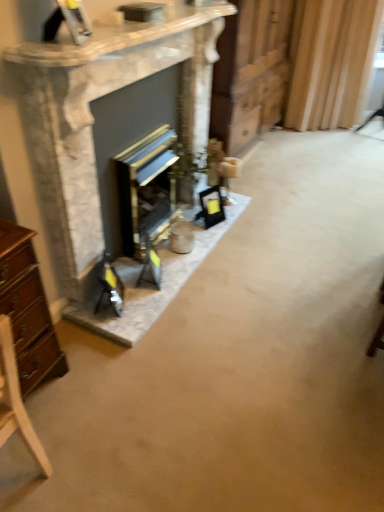
Question: Considering the relative positions of matte black picture frame at center and wooden at center in the image provided, is matte black picture frame at center to the left of wooden at center from the viewer's perspective?

Choices:
 (A) no
 (B) yes

Answer: (B)

Question: Would you say wooden at center is part of matte black picture frame at center's contents?

Choices:
 (A) yes
 (B) no

Answer: (B)

Question: Does matte black picture frame at center have a greater width compared to wooden at center?

Choices:
 (A) yes
 (B) no

Answer: (B)

Question: Considering the relative positions of matte black picture frame at center and wooden at center in the image provided, is matte black picture frame at center to the right of wooden at center from the viewer's perspective?

Choices:
 (A) no
 (B) yes

Answer: (A)

Question: Is matte black picture frame at center completely or partially outside of wooden at center?

Choices:
 (A) no
 (B) yes

Answer: (B)

Question: From the image's perspective, would you say matte black picture frame at center is positioned over wooden at center?

Choices:
 (A) yes
 (B) no

Answer: (B)

Question: Could you tell me if wooden at center is facing light wood chair at lower left?

Choices:
 (A) no
 (B) yes

Answer: (A)

Question: From a real-world perspective, is wooden at center on light wood chair at lower left?

Choices:
 (A) no
 (B) yes

Answer: (B)

Question: Is wooden at center facing away from light wood chair at lower left?

Choices:
 (A) yes
 (B) no

Answer: (B)

Question: Considering the relative positions of wooden at center and light wood chair at lower left in the image provided, is wooden at center to the left of light wood chair at lower left from the viewer's perspective?

Choices:
 (A) no
 (B) yes

Answer: (A)

Question: Is wooden at center bigger than light wood chair at lower left?

Choices:
 (A) no
 (B) yes

Answer: (B)

Question: From the image's perspective, does wooden at center appear lower than light wood chair at lower left?

Choices:
 (A) yes
 (B) no

Answer: (B)

Question: Does wooden at center have a lesser height compared to marble fireplace at center?

Choices:
 (A) yes
 (B) no

Answer: (B)